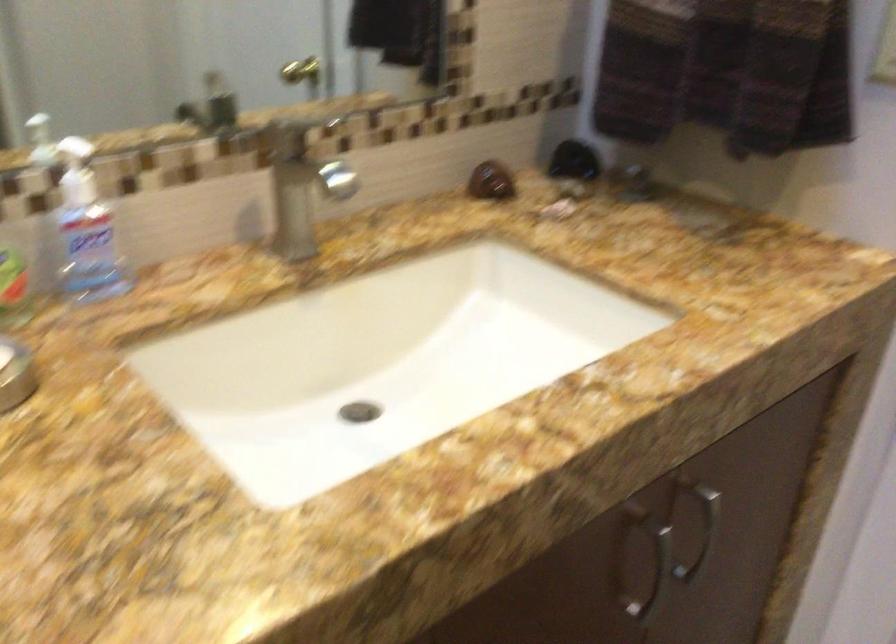
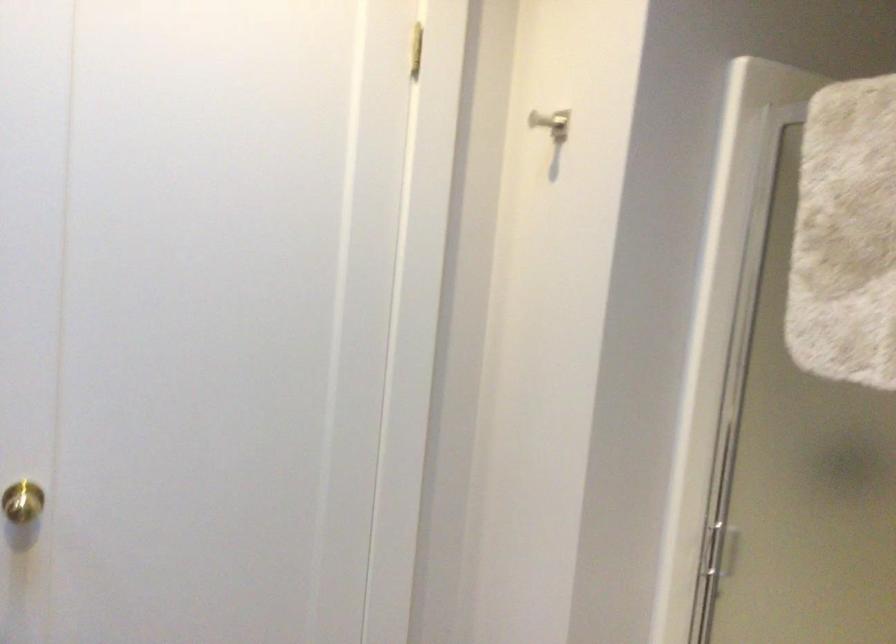
Question: The first image is from the beginning of the video and the second image is from the end. How did the camera likely rotate when shooting the video?

Choices:
 (A) Left
 (B) Right
 (C) Up
 (D) Down

Answer: (B)